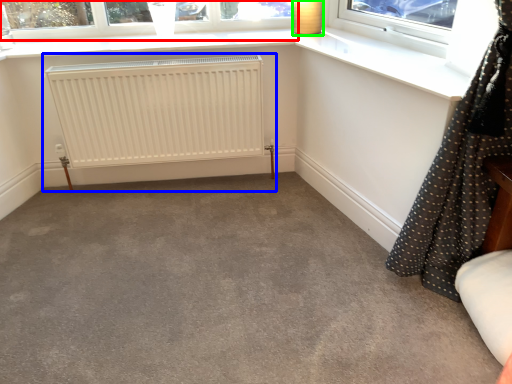
Question: Which is nearer to the window (highlighted by a red box)? radiator (highlighted by a blue box) or lamp (highlighted by a green box).

Choices:
 (A) radiator
 (B) lamp

Answer: (A)